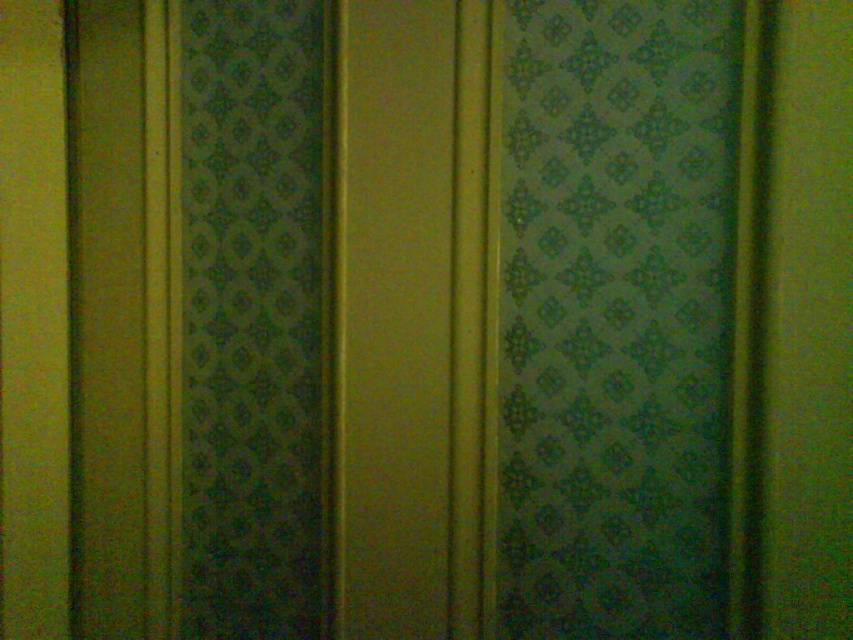
Can you confirm if green patterned curtain at right is smaller than green patterned curtain at left?

Actually, green patterned curtain at right might be larger than green patterned curtain at left.

Where is `green patterned curtain at right`? green patterned curtain at right is located at coordinates (614, 316).